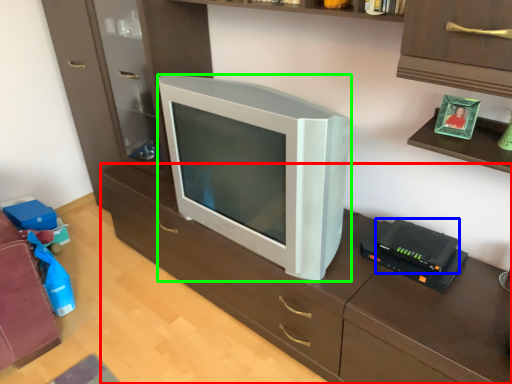
Question: Which object is positioned closest to computer desk (highlighted by a red box)? Select from gadget (highlighted by a blue box) and television (highlighted by a green box).

Choices:
 (A) gadget
 (B) television

Answer: (B)